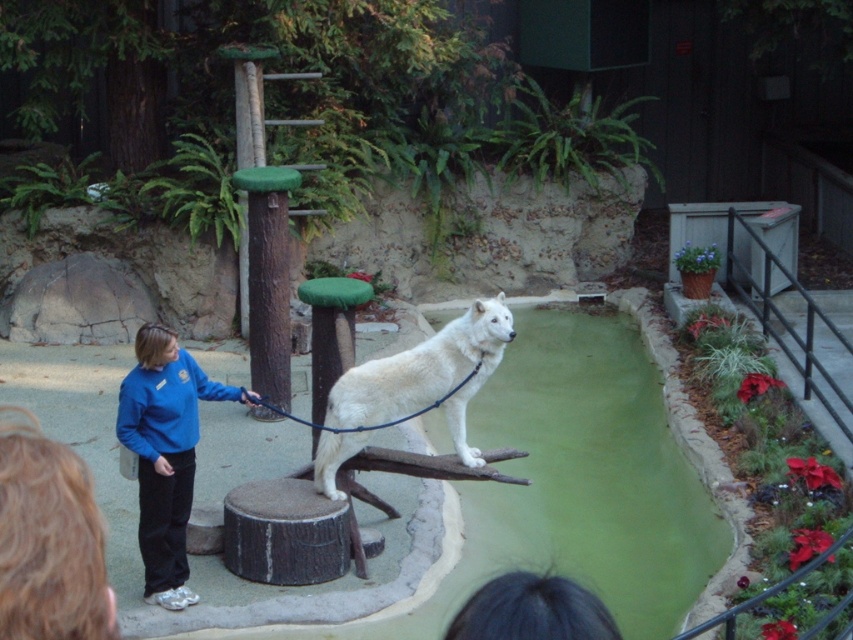
You are a zookeeper planning to measure the space between the blue fleece jacket at center and the white fur dog at center for safety. Which object takes up more horizontal space in the image?

The white fur dog at center takes up more horizontal space than the blue fleece jacket at center because the blue fleece jacket at center has a lesser width compared to the white fur dog at center.

You are a zookeeper planning to place a new feeding station in the enclosure. The feeding station requires a space larger than the area occupied by the blue fleece jacket at center. Will the white fur dog at center provide enough space for this?

The blue fleece jacket at center occupies less space than the white fur dog at center, so the white fur dog at center provides enough space for the feeding station since it occupies more area.

You are standing at the point marked as point (165, 452). There is a blue fleece jacket at center. Can you see the white wolf on the log in the foreground?

The blue fleece jacket at center is located at point (165, 452). Since you are standing at that point, you are at the location of the jacket. The white wolf on the log in the foreground is part of the foreground scene, so yes, you can see the white wolf on the log in the foreground from there.